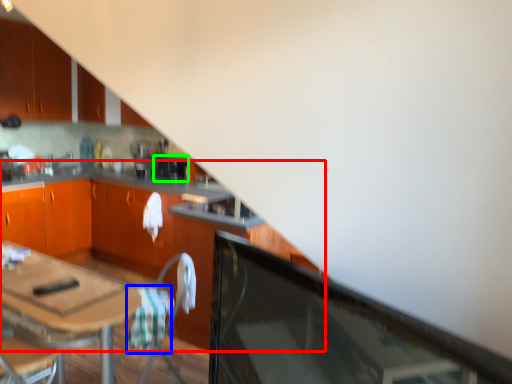
Question: Which object is the farthest from cabinetry (highlighted by a red box)? Choose among these: blanket (highlighted by a blue box) or appliance (highlighted by a green box).

Choices:
 (A) blanket
 (B) appliance

Answer: (A)